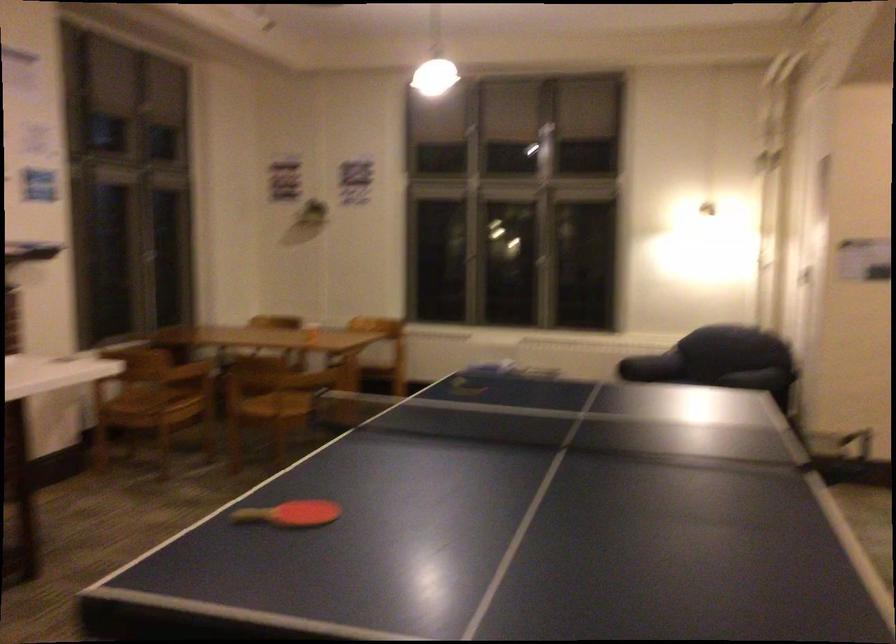
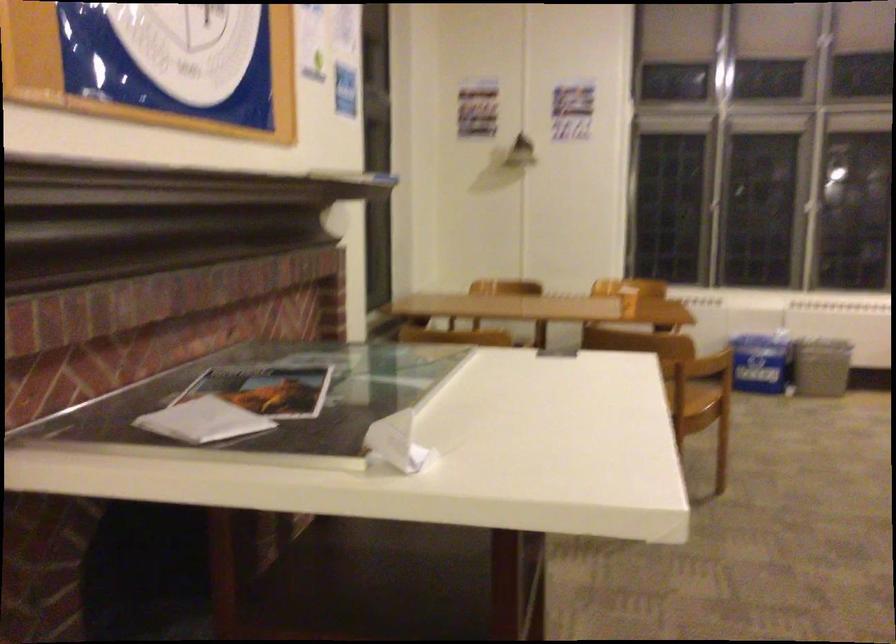
Which direction would the cameraman need to move to produce the second image?

The movement direction of the cameraman is left, forward.